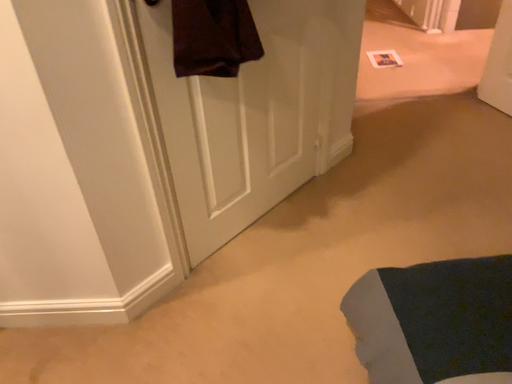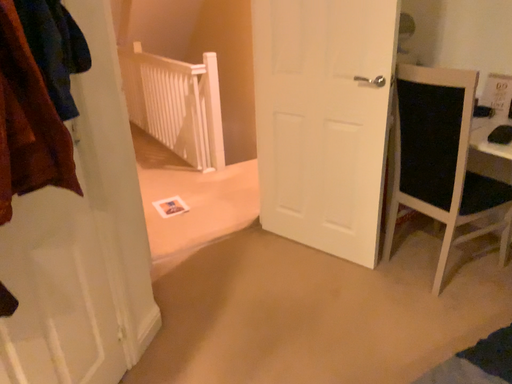
Question: Which way did the camera rotate in the video?

Choices:
 (A) rotated downward
 (B) rotated upward

Answer: (B)